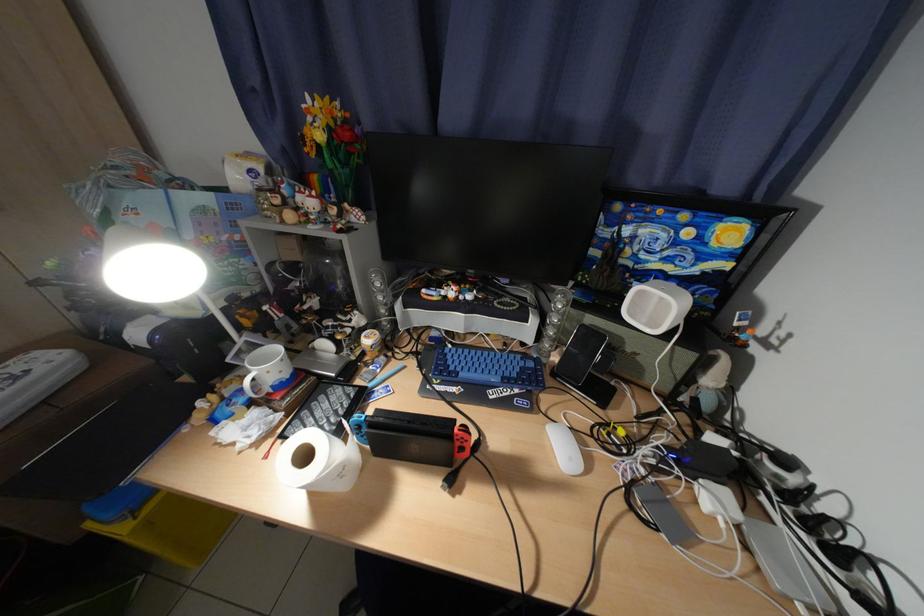
Where is `small cylindrical can`? small cylindrical can is located at coordinates (371, 342).